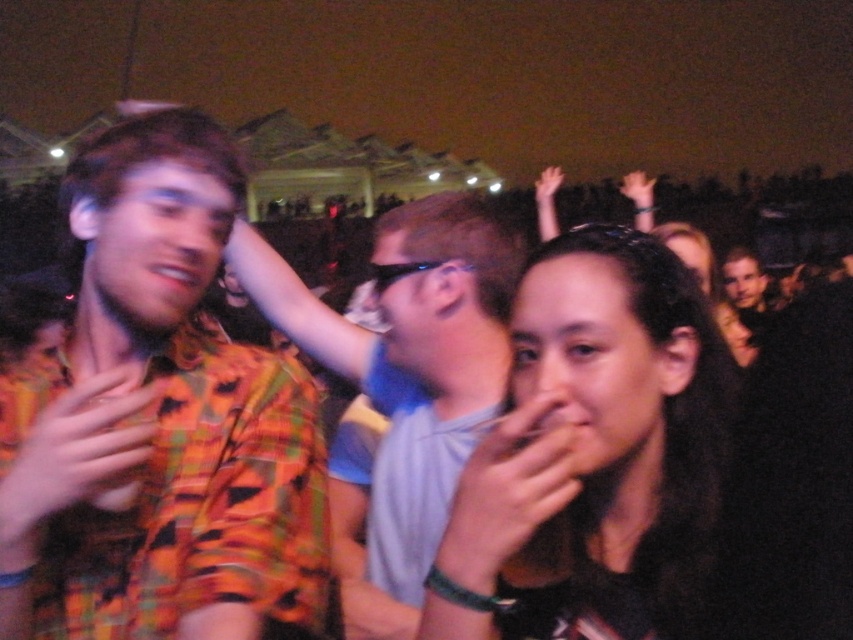
Question: Which of the following is the closest to the observer?

Choices:
 (A) plaid shirt at center
 (B) smooth skin hand at center
 (C) plaid shirt at left
 (D) orange plaid shirt at center

Answer: (B)

Question: Among these objects, which one is nearest to the camera?

Choices:
 (A) plaid shirt at center
 (B) plaid shirt at left
 (C) smooth skin hand at center

Answer: (C)

Question: Which object is closer to the camera taking this photo?

Choices:
 (A) orange plaid shirt at center
 (B) smooth skin hand at center

Answer: (B)

Question: Observing the image, what is the correct spatial positioning of black matte hair at center in reference to orange plaid shirt at center?

Choices:
 (A) below
 (B) above

Answer: (B)

Question: Can you confirm if plaid shirt at center is positioned below black matte hair at center?

Choices:
 (A) no
 (B) yes

Answer: (A)

Question: Does plaid shirt at center have a greater width compared to orange plaid shirt at center?

Choices:
 (A) no
 (B) yes

Answer: (B)